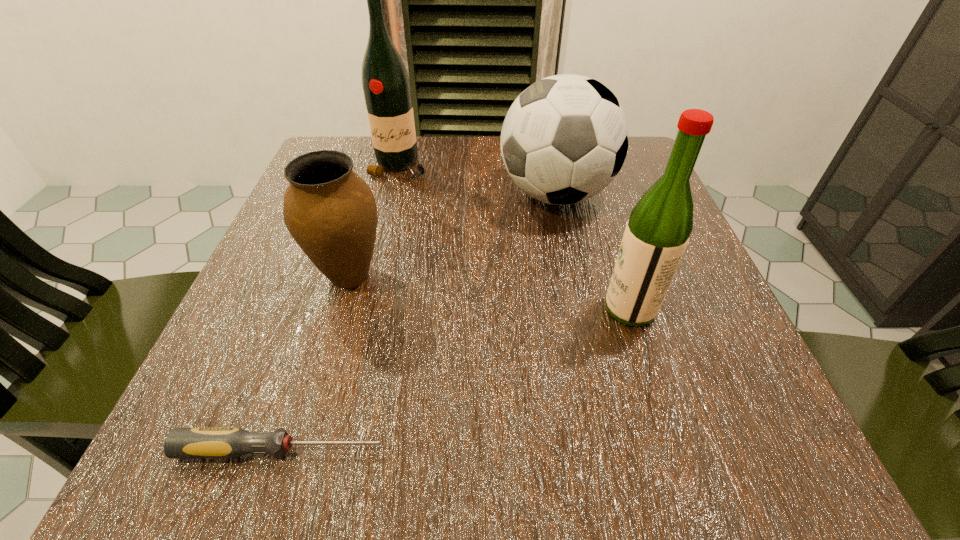
Identify the location of wine bottle. (386, 86).

This screenshot has width=960, height=540. I want to click on liquor, so click(657, 233).

Find the location of a particular element. Image resolution: width=960 pixels, height=540 pixels. soccer ball is located at coordinates (564, 139).

Find the location of a particular element. The height and width of the screenshot is (540, 960). urn is located at coordinates (330, 211).

Identify the location of screwdriver. The width and height of the screenshot is (960, 540). (229, 442).

Identify the location of the nearest object. The width and height of the screenshot is (960, 540). (229, 442).

In order to click on free region located 0.310m on the surface of the wine bottle in this screenshot , I will do `click(369, 293)`.

This screenshot has width=960, height=540. I want to click on vacant space located on the label of the liquor, so click(427, 309).

This screenshot has width=960, height=540. What are the coordinates of `vacant space located on the label of the liquor` in the screenshot? It's located at (355, 309).

I want to click on free space located on the label of the liquor, so click(x=506, y=309).